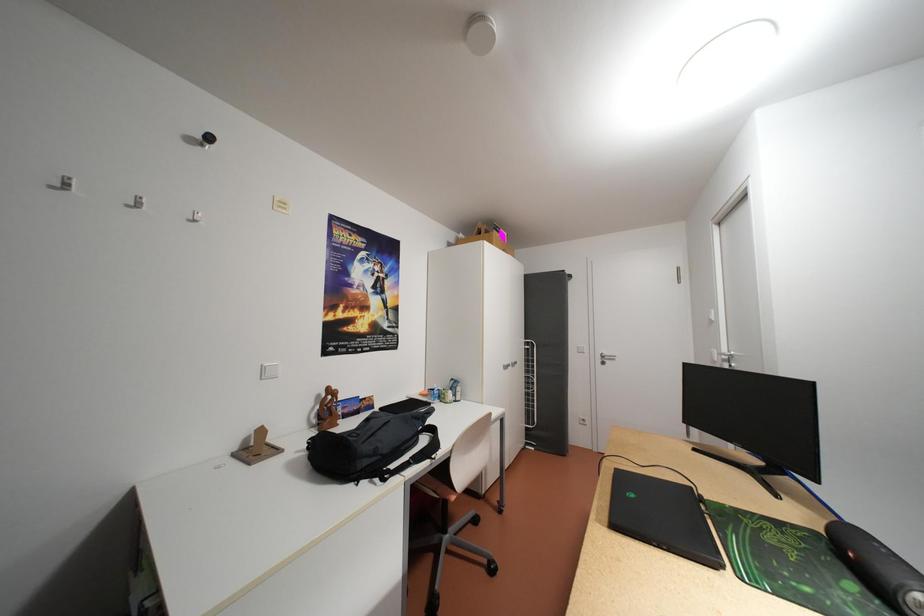
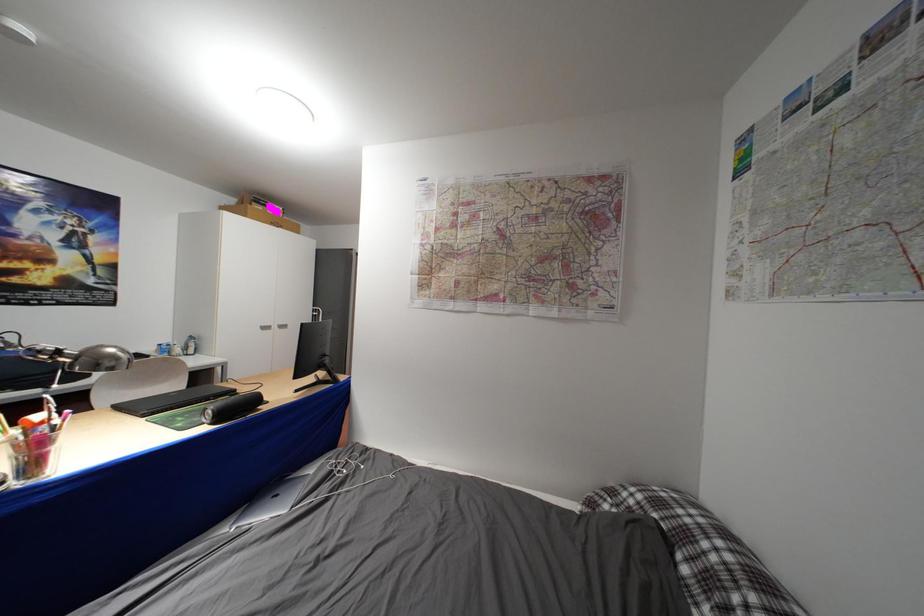
In a continuous first-person perspective shot, in which direction is the camera moving?

The cameraman moved toward right, backward.